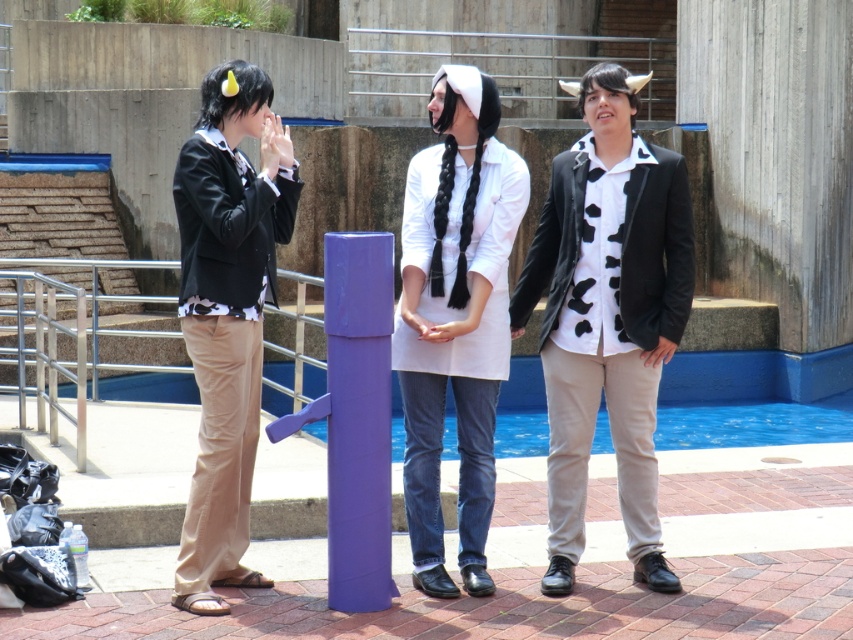
Can you confirm if white matte shirt at center is positioned above purple glossy post at center?

Yes, white matte shirt at center is above purple glossy post at center.

Is white matte shirt at center to the left of purple glossy post at center from the viewer's perspective?

Incorrect, white matte shirt at center is not on the left side of purple glossy post at center.

Between point (456, 83) and point (335, 474), which one is positioned in front?

Point (335, 474) is more forward.

Identify the location of white matte shirt at center. (456, 317).

Does matte black jacket at center appear over white matte shirt at center?

No.

This screenshot has width=853, height=640. Describe the element at coordinates (607, 317) in the screenshot. I see `matte black jacket at center` at that location.

Is point (585, 189) positioned in front of point (416, 301)?

No, it is not.

This screenshot has height=640, width=853. Identify the location of matte black jacket at center. (607, 317).

Describe the element at coordinates (227, 314) in the screenshot. This screenshot has width=853, height=640. I see `matte black jacket at left` at that location.

Is matte black jacket at left in front of purple glossy post at center?

No.

Between point (251, 472) and point (339, 257), which one is positioned behind?

Point (251, 472)

I want to click on matte black jacket at left, so click(227, 314).